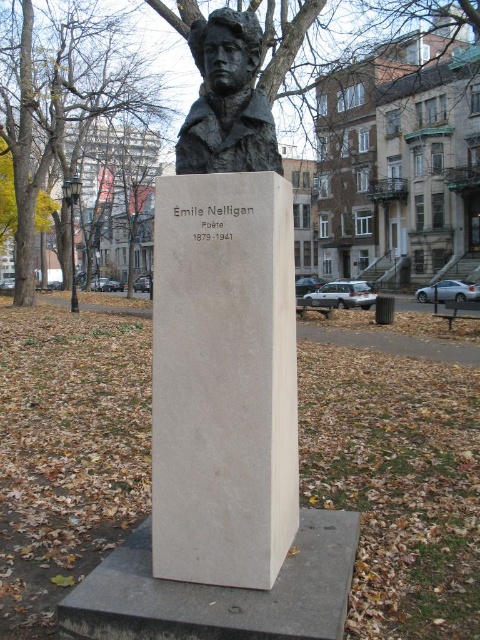
Can you confirm if white marble bust at center is taller than green leafy tree at upper left?

Incorrect, white marble bust at center's height is not larger of green leafy tree at upper left's.

Can you confirm if white marble bust at center is thinner than green leafy tree at upper left?

Indeed, white marble bust at center has a lesser width compared to green leafy tree at upper left.

Is point (186, 336) positioned after point (64, 42)?

No, it is in front of (64, 42).

Locate an element on the screen. This screenshot has height=640, width=480. white marble bust at center is located at coordinates (225, 330).

Is white marble bust at center taller than yellow leafy tree at upper left?

Incorrect, white marble bust at center's height is not larger of yellow leafy tree at upper left's.

Is white marble bust at center above yellow leafy tree at upper left?

No.

Find the location of `white marble bust at center`. white marble bust at center is located at coordinates (225, 330).

What are the coordinates of `white marble bust at center` in the screenshot? It's located at (225, 330).

Can you confirm if white marble bust at center is wider than bronze bust at upper center?

Correct, the width of white marble bust at center exceeds that of bronze bust at upper center.

Is point (192, 285) farther from viewer compared to point (232, 26)?

No, (192, 285) is closer to viewer.

The image size is (480, 640). Find the location of `white marble bust at center`. white marble bust at center is located at coordinates (225, 330).